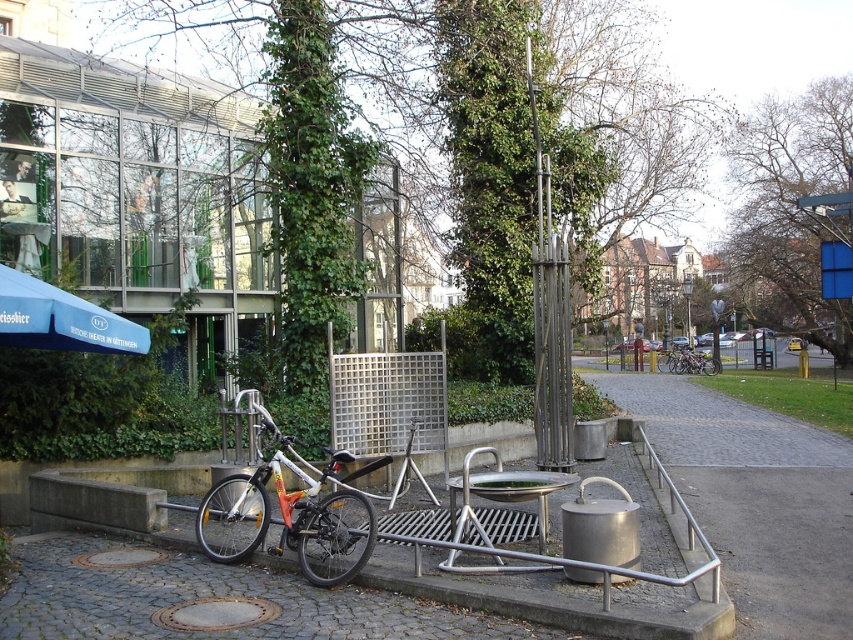
Question: Which point is farther to the camera?

Choices:
 (A) blue fabric umbrella at left
 (B) white matte bicycle at center
 (C) shiny silver bicycle at center

Answer: (C)

Question: From the image, what is the correct spatial relationship of blue fabric umbrella at left in relation to shiny silver bicycle at center?

Choices:
 (A) above
 (B) below

Answer: (A)

Question: Which of the following is the closest to the observer?

Choices:
 (A) white matte bicycle at center
 (B) blue fabric umbrella at left
 (C) shiny silver bicycle at center

Answer: (A)

Question: Is blue fabric umbrella at left to the right of shiny silver bicycle at center from the viewer's perspective?

Choices:
 (A) yes
 (B) no

Answer: (B)

Question: Which of these objects is positioned closest to the shiny silver bicycle at center?

Choices:
 (A) white matte bicycle at center
 (B) blue fabric umbrella at left

Answer: (A)

Question: Is white matte bicycle at center wider than blue fabric umbrella at left?

Choices:
 (A) no
 (B) yes

Answer: (A)